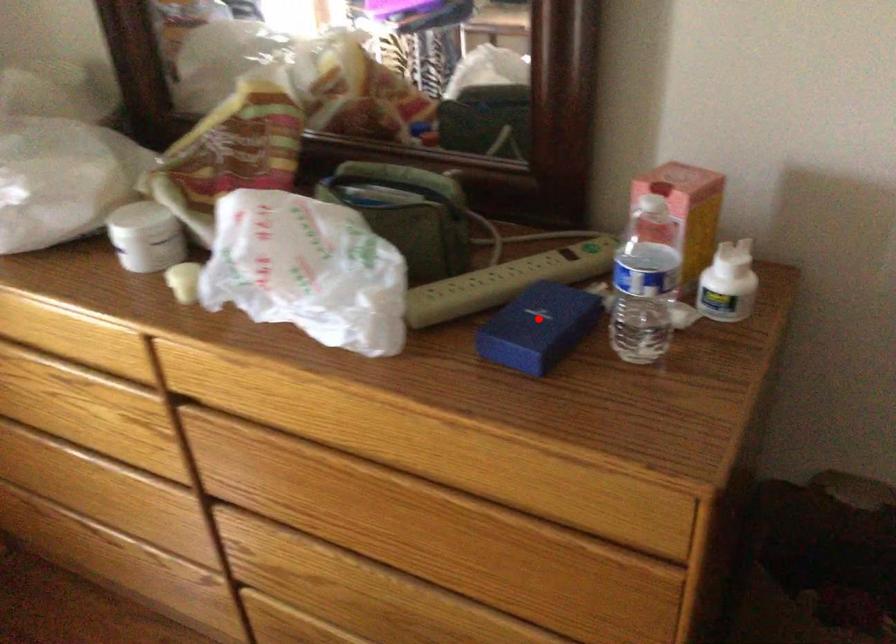
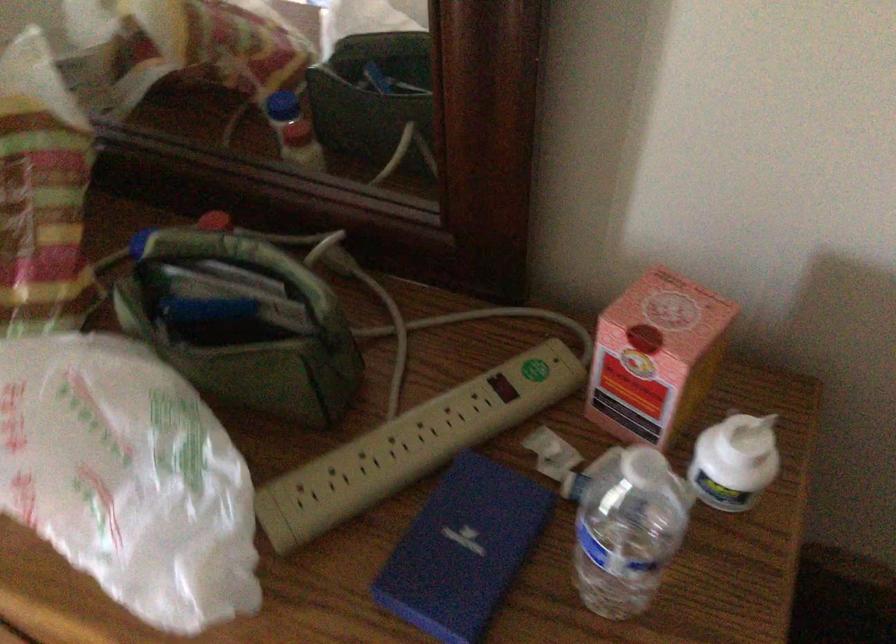
Question: I am providing you with two images of the same scene from different viewpoints. A red point is shown in image1. For the corresponding object point in image2, is it positioned nearer or farther from the camera?

Choices:
 (A) Nearer
 (B) Farther

Answer: (A)